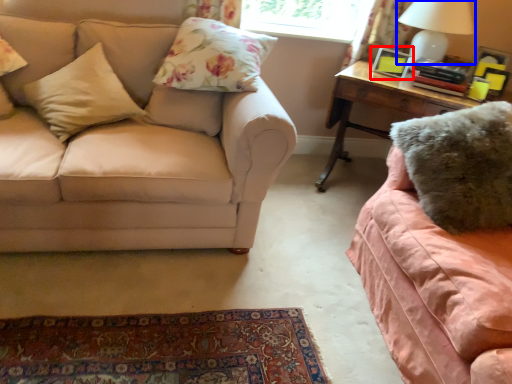
Question: Which object is closer to the camera taking this photo, picture frame (highlighted by a red box) or table lamp (highlighted by a blue box)?

Choices:
 (A) picture frame
 (B) table lamp

Answer: (B)